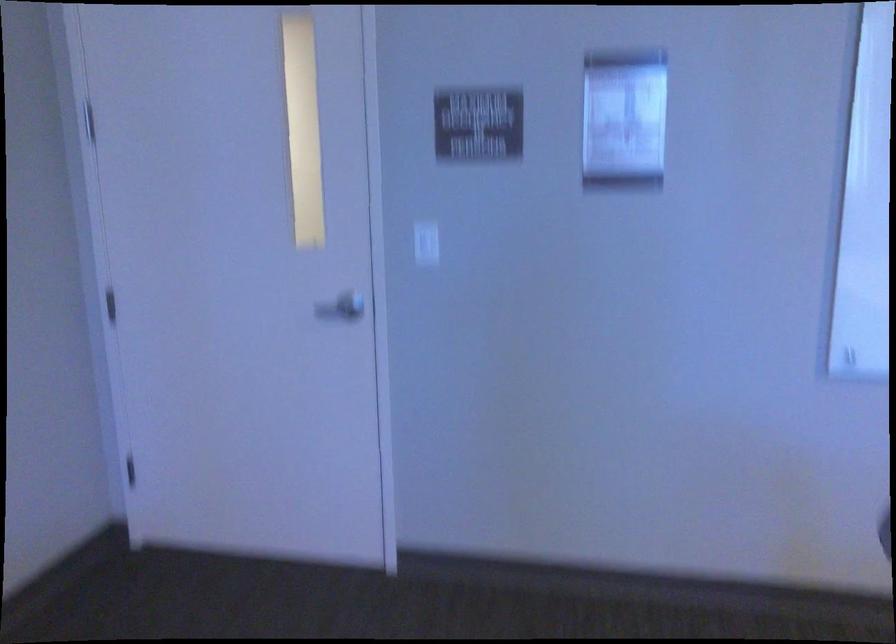
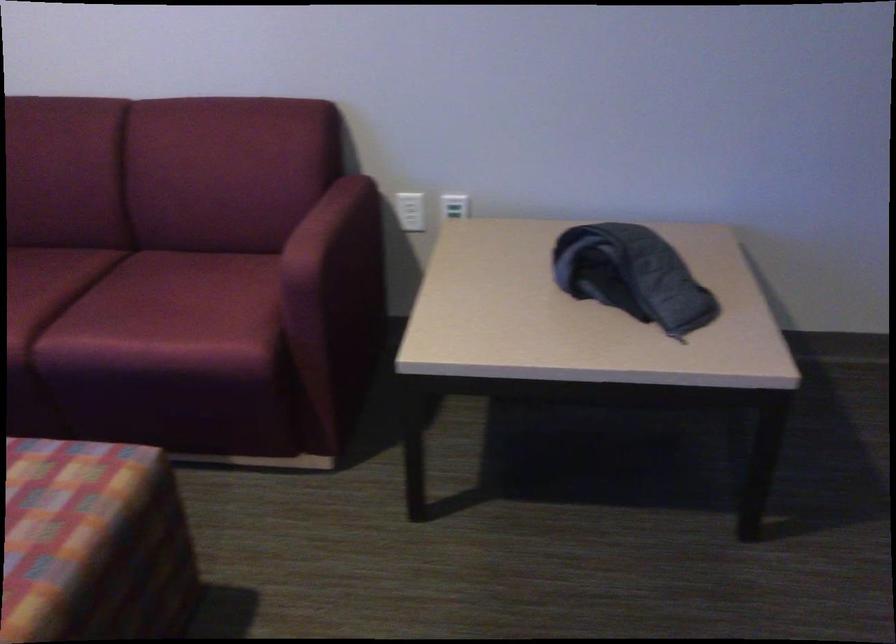
The images are taken continuously from a first-person perspective. In which direction is your viewpoint rotating?

The camera's rotation is toward left-down.